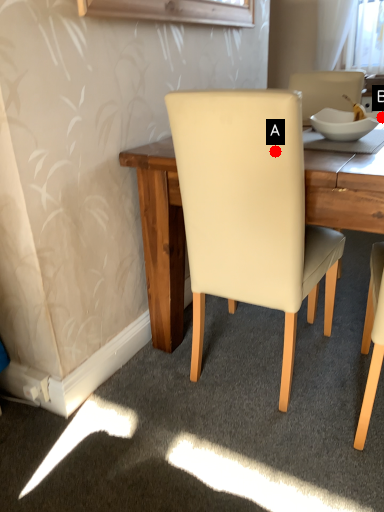
Question: Two points are circled on the image, labeled by A and B beside each circle. Among these points, which one is nearest to the camera?

Choices:
 (A) A is closer
 (B) B is closer

Answer: (A)